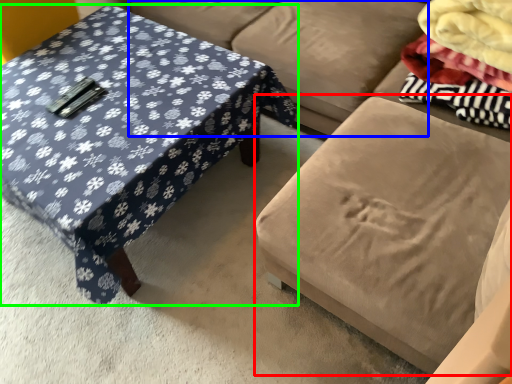
Question: Considering the real-world distances, which object is farthest from swivel chair (highlighted by a red box)? couch (highlighted by a blue box) or coffee table (highlighted by a green box)?

Choices:
 (A) couch
 (B) coffee table

Answer: (B)